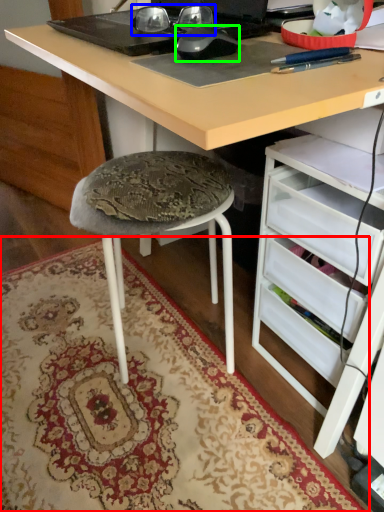
Question: Estimate the real-world distances between objects in this image. Which object is farther from mat (highlighted by a red box), glasses (highlighted by a blue box) or mouse (highlighted by a green box)?

Choices:
 (A) glasses
 (B) mouse

Answer: (A)